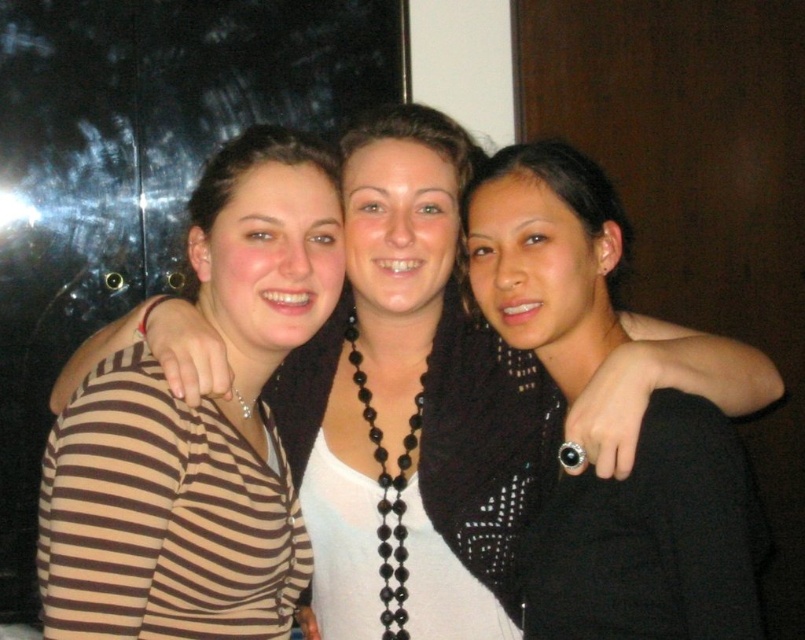
You are standing in front of a group photo of three people. You need to determine the order of the people from closest to farthest from you. The people are wearing a brown striped shirt at left and a black beaded necklace at center. Which one is closer to you?

The brown striped shirt at left is closer to you than the black beaded necklace at center because the brown striped shirt at left is further to the viewer than the black beaded necklace at center.

You are taking a photo of three friends. You need to place a decorative sticker on the leftmost person. Which person should you choose between the brown striped shirt at left and the black beaded necklace at center?

The brown striped shirt at left is to the left of the black beaded necklace at center, so you should place the sticker on the brown striped shirt at left since it is the leftmost person.

You are taking a photo of three friends standing in a line. You notice two points marked as point coordinates in the image. The first point is at coordinates point (60,580) and the second point is at coordinates point (702,413). Based on their positions, which point is closer to the camera?

Point (60,580) is in front of point (702,413), so it is closer to the camera.